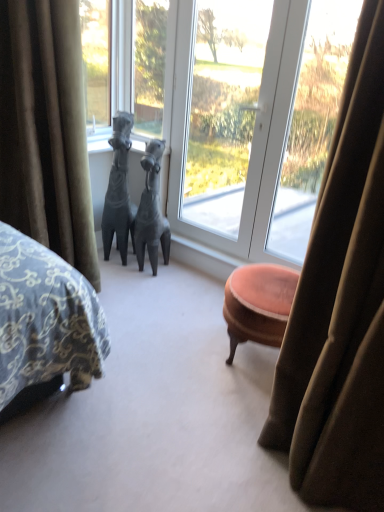
Question: Is velvet green curtain at left behind transparent glass window at center?

Choices:
 (A) no
 (B) yes

Answer: (A)

Question: From the image's perspective, is velvet green curtain at left below transparent glass window at center?

Choices:
 (A) yes
 (B) no

Answer: (A)

Question: From a real-world perspective, is velvet green curtain at left over transparent glass window at center?

Choices:
 (A) no
 (B) yes

Answer: (A)

Question: Is velvet green curtain at left bigger than transparent glass window at center?

Choices:
 (A) no
 (B) yes

Answer: (B)

Question: Is velvet green curtain at left wider than transparent glass window at center?

Choices:
 (A) yes
 (B) no

Answer: (A)

Question: Does point (165, 142) appear closer or farther from the camera than point (241, 86)?

Choices:
 (A) closer
 (B) farther

Answer: (B)

Question: Is transparent glass window at center wider or thinner than transparent glass window at center?

Choices:
 (A) thin
 (B) wide

Answer: (A)

Question: From the image's perspective, is transparent glass window at center above or below transparent glass window at center?

Choices:
 (A) below
 (B) above

Answer: (A)

Question: From a real-world perspective, is transparent glass window at center positioned above or below transparent glass window at center?

Choices:
 (A) below
 (B) above

Answer: (B)

Question: From their relative heights in the image, would you say matte gray horse at center, placed as the 1th animal when sorted from left to right, is taller or shorter than transparent glass window at center?

Choices:
 (A) short
 (B) tall

Answer: (A)

Question: Relative to transparent glass window at center, is matte gray horse at center, placed as the 1th animal when sorted from left to right, in front or behind?

Choices:
 (A) front
 (B) behind

Answer: (B)

Question: From the image's perspective, is matte gray horse at center, the 2th animal in the right-to-left sequence, located above or below transparent glass window at center?

Choices:
 (A) below
 (B) above

Answer: (A)

Question: In terms of size, does matte gray horse at center, placed as the 1th animal when sorted from left to right, appear bigger or smaller than transparent glass window at center?

Choices:
 (A) small
 (B) big

Answer: (A)

Question: Is point (145, 203) closer or farther from the camera than point (254, 28)?

Choices:
 (A) farther
 (B) closer

Answer: (A)

Question: Is matte gray horse at center, which is counted as the second animal, starting from the left, spatially inside transparent glass window at center, or outside of it?

Choices:
 (A) outside
 (B) inside

Answer: (A)